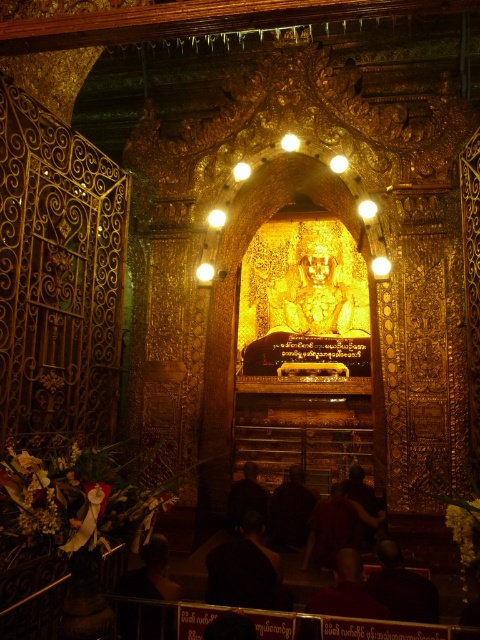
Question: From the image, what is the correct spatial relationship of black matte person at lower center in relation to dark brown fabric at center?

Choices:
 (A) below
 (B) above

Answer: (B)

Question: Which point is farther to the camera?

Choices:
 (A) dark red fabric at center
 (B) dark brown fabric at lower center
 (C) dark fabric figure at center
 (D) dark brown monk at center

Answer: (C)

Question: Among these points, which one is nearest to the camera?

Choices:
 (A) (317, 600)
 (B) (409, 616)
 (C) (335, 532)
 (D) (257, 541)

Answer: (A)

Question: Which point is closer to the camera?

Choices:
 (A) dark brown monk at center
 (B) dark brown fabric at lower center
 (C) black matte person at lower center
 (D) dark brown fabric at center

Answer: (A)

Question: Is dark brown fabric at lower center below dark brown fabric at center?

Choices:
 (A) no
 (B) yes

Answer: (B)

Question: Is black matte person at lower center smaller than dark brown monk at center?

Choices:
 (A) no
 (B) yes

Answer: (A)